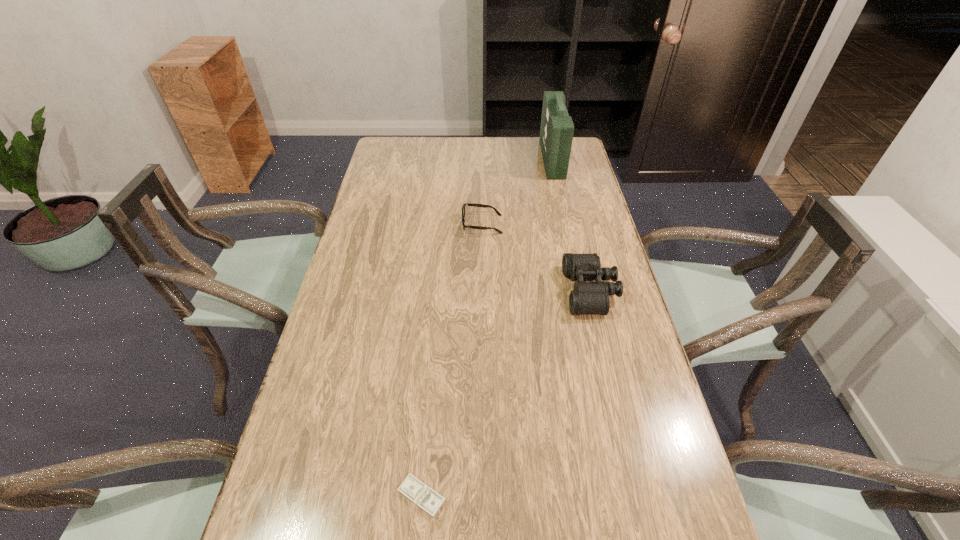
Find the location of `free space between the shortest object and the second farthest object`. free space between the shortest object and the second farthest object is located at coordinates (452, 360).

I want to click on empty space between the farthest object and the money, so click(x=487, y=327).

This screenshot has width=960, height=540. I want to click on vacant point located between the nearest object and the second tallest object, so click(506, 394).

This screenshot has height=540, width=960. Find the location of `free space between the spectacles and the farthest object`. free space between the spectacles and the farthest object is located at coordinates (517, 192).

Find the location of a particular element. Image resolution: width=960 pixels, height=540 pixels. vacant space that is in between the spectacles and the farthest object is located at coordinates (517, 192).

You are a GUI agent. You are given a task and a screenshot of the screen. Output one action in this format:
    pyautogui.click(x=<x>, y=<y>)
    Task: Click on the vacant area that lies between the third farthest object and the first-aid kit
    The width and height of the screenshot is (960, 540).
    Given the screenshot: What is the action you would take?
    pyautogui.click(x=571, y=225)

I want to click on unoccupied area between the second tallest object and the tallest object, so click(x=571, y=225).

Image resolution: width=960 pixels, height=540 pixels. In order to click on object that is the nearest to the farthest object in this screenshot , I will do `click(465, 204)`.

At what (x,y) coordinates should I click in order to perform the action: click on object that ranks as the third closest to the binoculars. Please return your answer as a coordinate pair (x, y). Looking at the image, I should click on (x=420, y=494).

Find the location of a particular element. The height and width of the screenshot is (540, 960). vacant region that satisfies the following two spatial constraints: 1. at the eyepieces of the second nearest object; 2. on the front side of the shortest object is located at coordinates (640, 496).